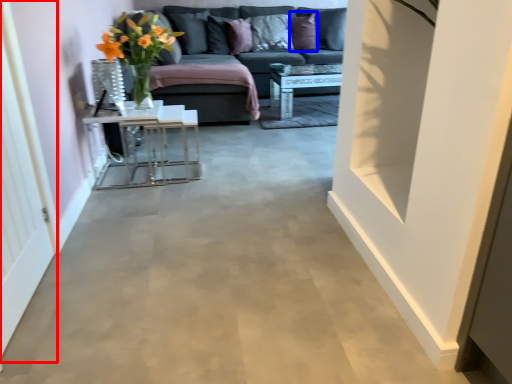
Question: Which of the following is the farthest to the observer, glass door (highlighted by a red box) or pillow (highlighted by a blue box)?

Choices:
 (A) glass door
 (B) pillow

Answer: (B)